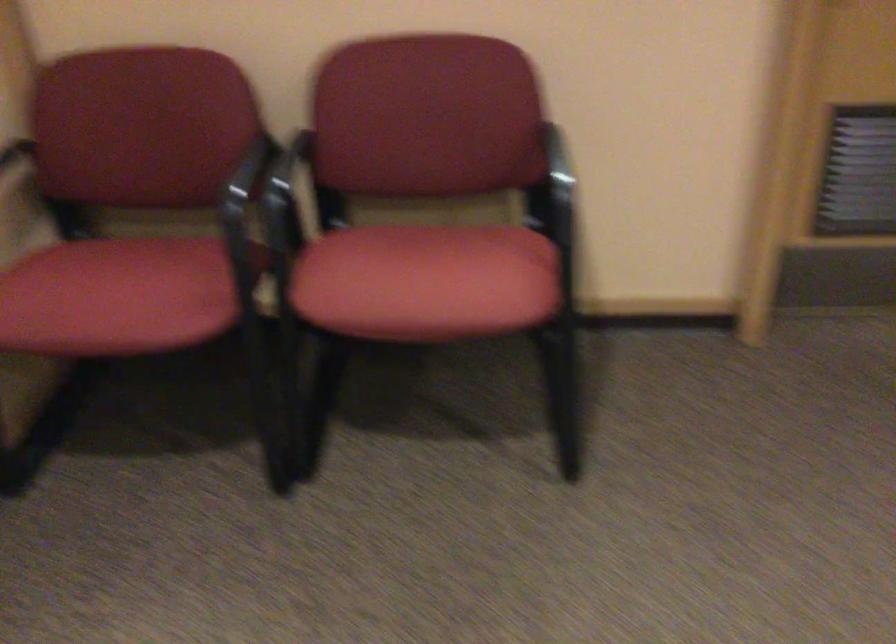
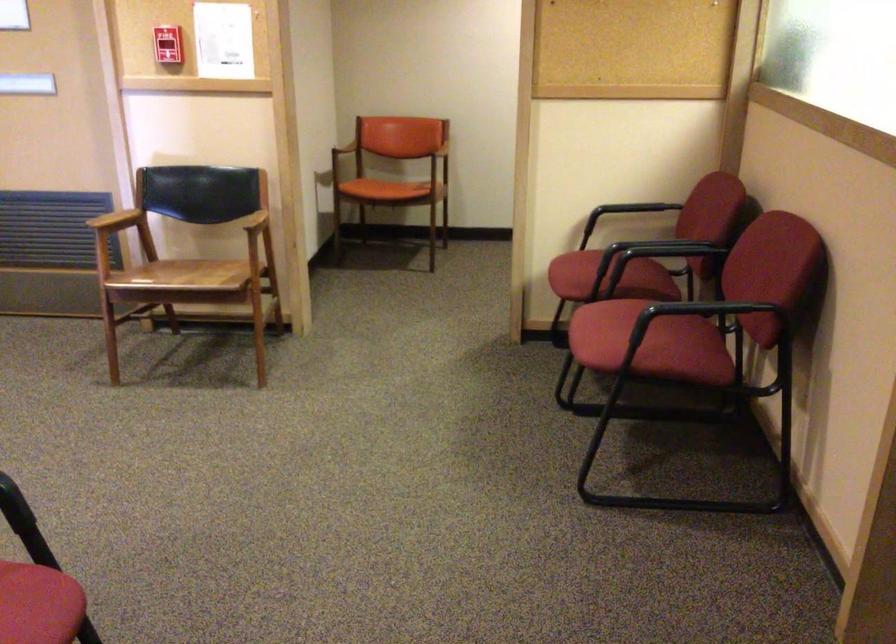
Find the pixel in the second image that matches (244,212) in the first image.

(602, 250)